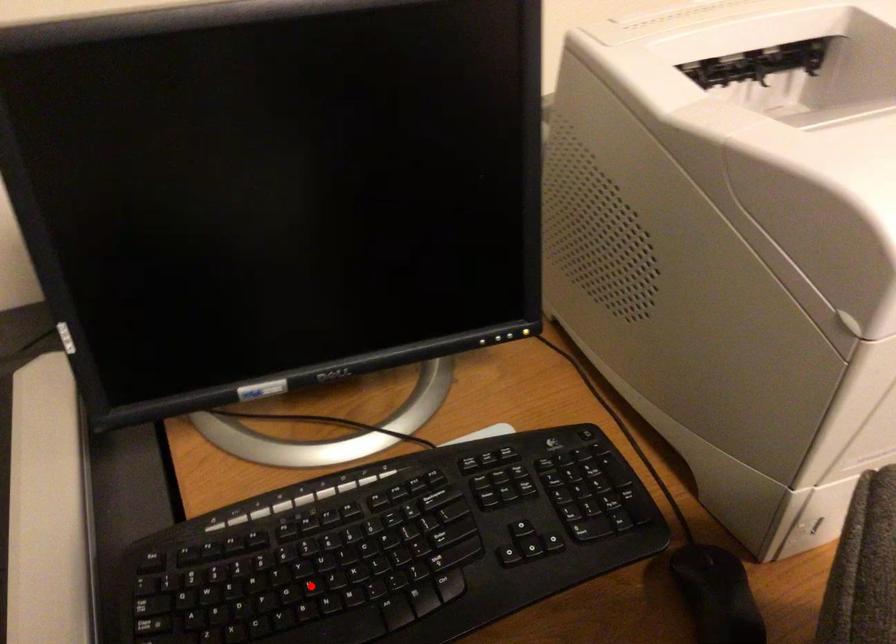
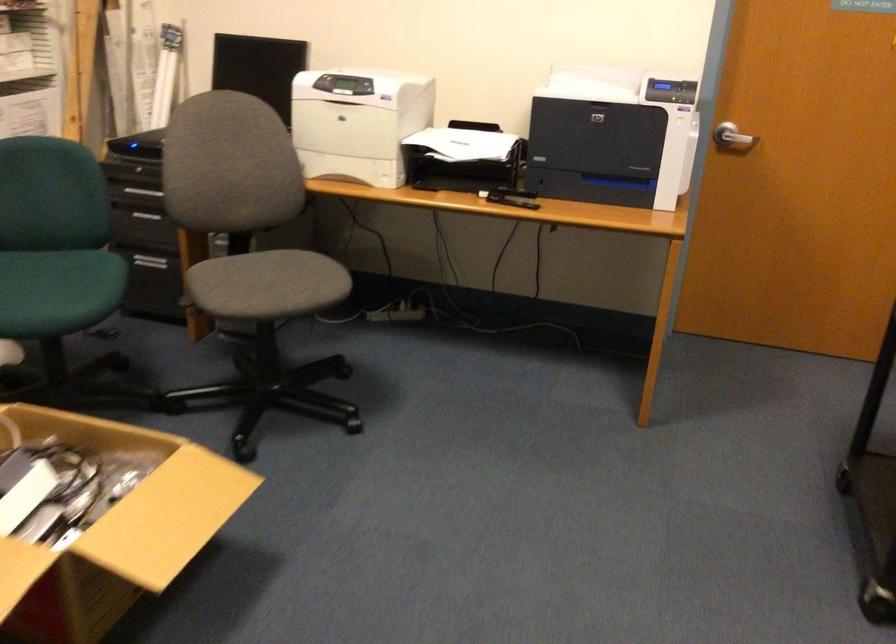
Question: I am providing you with two images of the same scene from different viewpoints. A red point is marked on the first image. At the location where the point appears in image 1, is it still visible in image 2?

Choices:
 (A) Yes
 (B) No

Answer: (B)